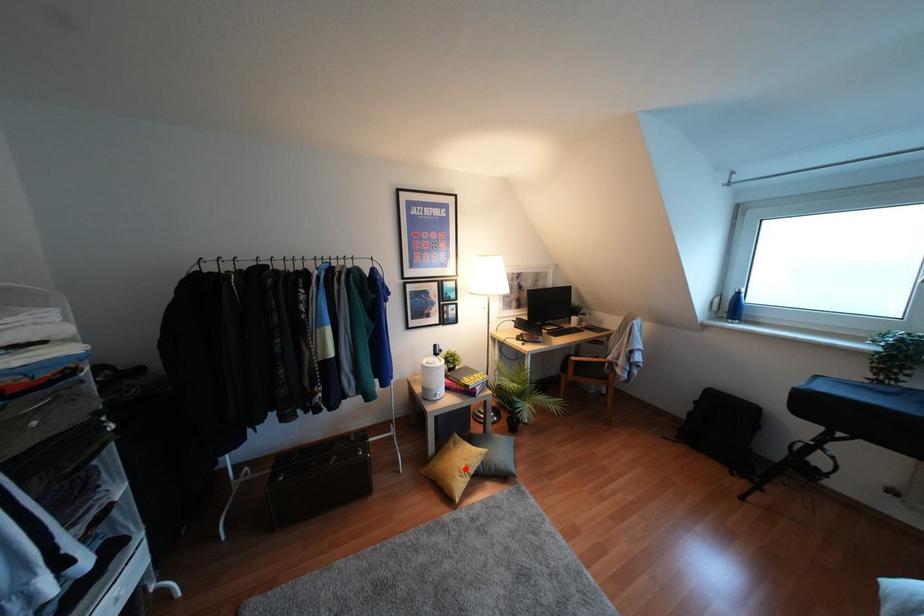
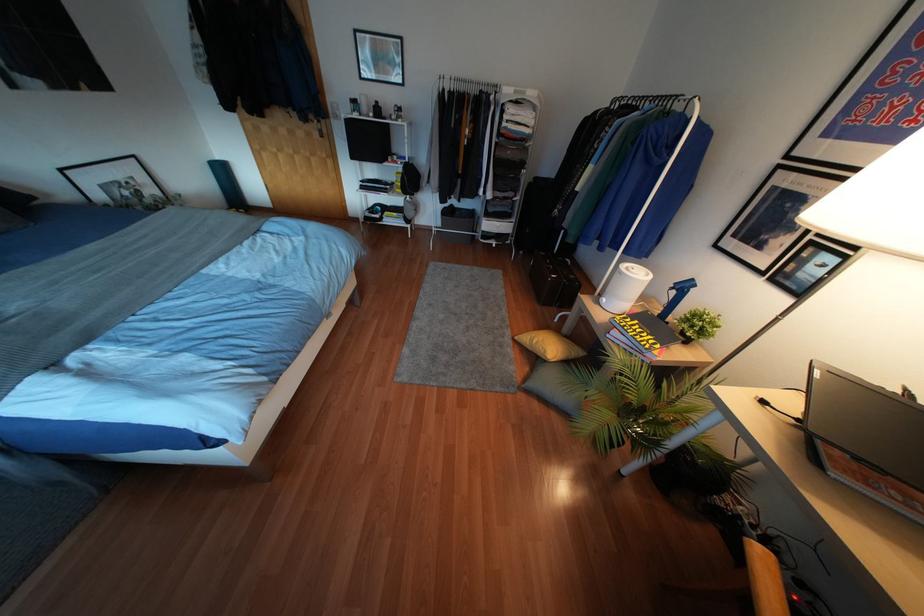
In the second image, find the point that corresponds to the highlighted location in the first image.

(533, 341)